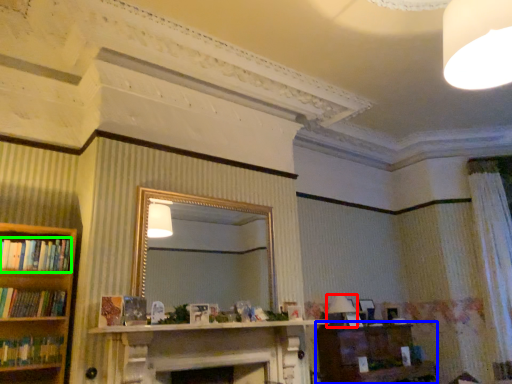
Question: Which object is the farthest from lamp (highlighted by a red box)? Choose among these: vanity (highlighted by a blue box) or book (highlighted by a green box).

Choices:
 (A) vanity
 (B) book

Answer: (B)